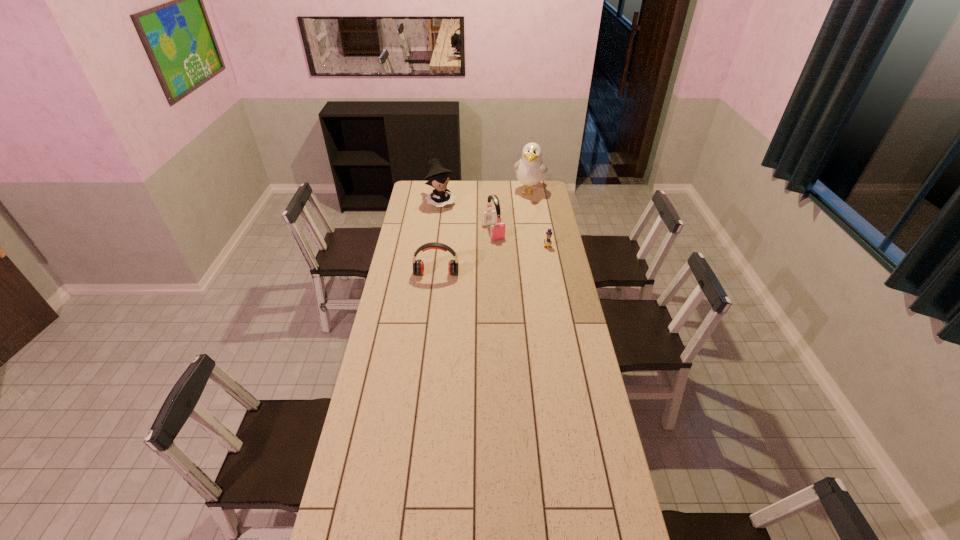
Locate an element on the screen. This screenshot has height=540, width=960. free region located 0.080m on the beak of the gull is located at coordinates (523, 208).

Identify the location of free region located on the beak of the gull. (521, 215).

Where is `vacant space located 0.200m on the beak of the gull`? vacant space located 0.200m on the beak of the gull is located at coordinates (520, 219).

This screenshot has width=960, height=540. Find the location of `free location located 0.360m at the face of the doll`. free location located 0.360m at the face of the doll is located at coordinates (473, 244).

The image size is (960, 540). What are the coordinates of `vacant area situated at the face of the doll` in the screenshot? It's located at (x=472, y=242).

Locate an element on the screen. This screenshot has height=540, width=960. free region located at the face of the doll is located at coordinates (476, 246).

The height and width of the screenshot is (540, 960). In order to click on blank area located on the outer surface of the taller earphone in this screenshot , I will do `click(508, 259)`.

This screenshot has width=960, height=540. I want to click on vacant space positioned on the outer surface of the taller earphone, so click(501, 247).

Image resolution: width=960 pixels, height=540 pixels. Find the location of `blank space located on the outer surface of the taller earphone`. blank space located on the outer surface of the taller earphone is located at coordinates (506, 256).

Find the location of a particular element. The width and height of the screenshot is (960, 540). gull located at the far edge is located at coordinates (530, 170).